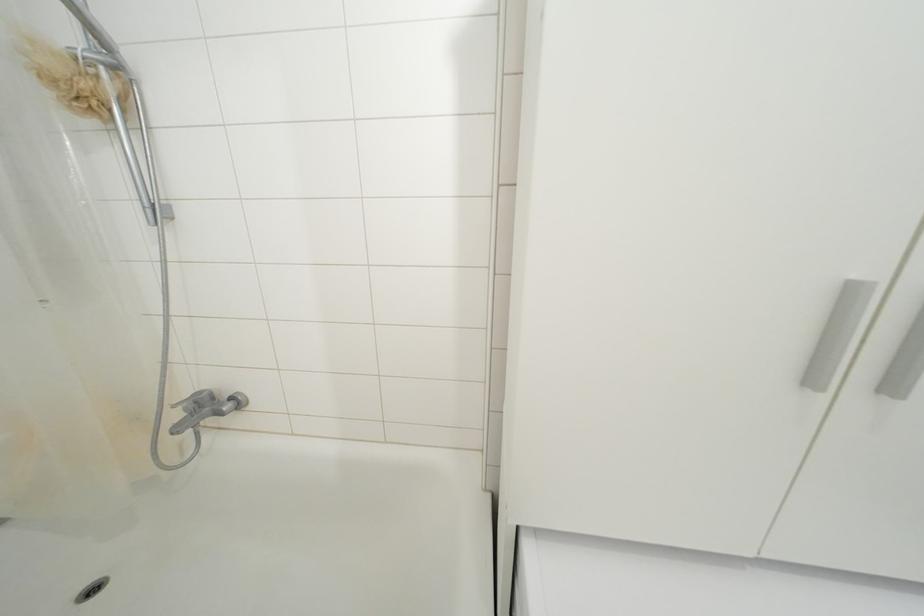
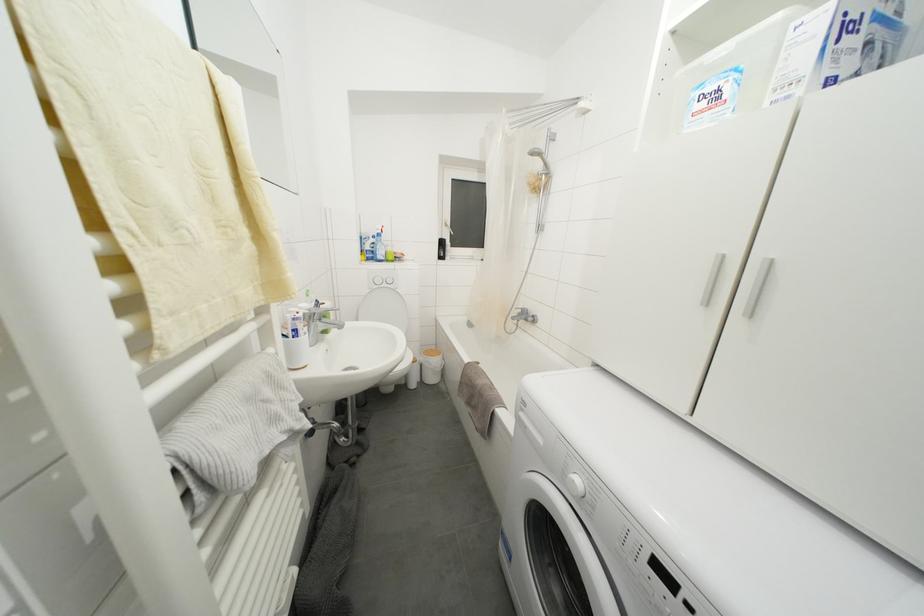
Question: The camera is either moving clockwise (left) or counter-clockwise (right) around the object. The first image is from the beginning of the video and the second image is from the end. Is the camera moving left or right when shooting the video?

Choices:
 (A) Left
 (B) Right

Answer: (B)